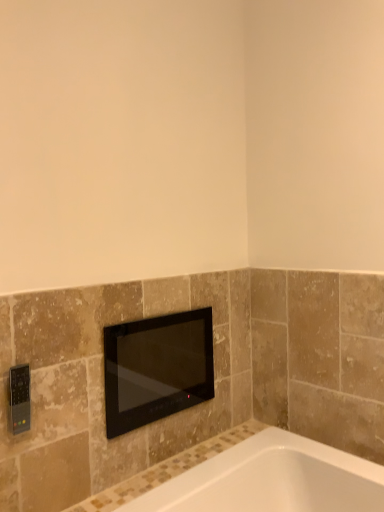
This screenshot has height=512, width=384. What do you see at coordinates (157, 368) in the screenshot?
I see `black glass television at center` at bounding box center [157, 368].

What is the approximate height of black glass television at center?

black glass television at center is 12.89 inches tall.

Locate an element on the screen. black glass television at center is located at coordinates (157, 368).

Identify the location of black plastic remote control at lower left. The image size is (384, 512). (20, 398).

This screenshot has width=384, height=512. What do you see at coordinates (20, 398) in the screenshot? I see `black plastic remote control at lower left` at bounding box center [20, 398].

I want to click on black glass television at center, so click(157, 368).

Is black plastic remote control at lower left at the left side of black glass television at center?

Yes.

Considering the relative positions of black plastic remote control at lower left and black glass television at center in the image provided, is black plastic remote control at lower left in front of black glass television at center?

Yes, the depth of black plastic remote control at lower left is less than that of black glass television at center.

Which is behind, point (24, 399) or point (132, 381)?

Positioned behind is point (132, 381).

From the image's perspective, is black plastic remote control at lower left above or below black glass television at center?

From the image's perspective, black plastic remote control at lower left appears above black glass television at center.

From a real-world perspective, is black plastic remote control at lower left positioned above or below black glass television at center?

From a real-world perspective, black plastic remote control at lower left is physically above black glass television at center.

Based on the photo, is black plastic remote control at lower left thinner than black glass television at center?

Correct, the width of black plastic remote control at lower left is less than that of black glass television at center.

Between black plastic remote control at lower left and black glass television at center, which one has more height?

black glass television at center.

Considering the relative sizes of black plastic remote control at lower left and black glass television at center in the image provided, is black plastic remote control at lower left bigger than black glass television at center?

Incorrect, black plastic remote control at lower left is not larger than black glass television at center.

Would you say black glass television at center is part of black plastic remote control at lower left's contents?

No, black plastic remote control at lower left does not contain black glass television at center.

Is black plastic remote control at lower left far away from black glass television at center?

No, black plastic remote control at lower left is in close proximity to black glass television at center.

Is black plastic remote control at lower left facing towards black glass television at center?

No, black plastic remote control at lower left is not oriented towards black glass television at center.

You are a GUI agent. You are given a task and a screenshot of the screen. Output one action in this format:
    pyautogui.click(x=<x>, y=<y>)
    Task: Click on the television behind the black plastic remote control at lower left
    Image resolution: width=384 pixels, height=512 pixels.
    Given the screenshot: What is the action you would take?
    pyautogui.click(x=157, y=368)

Which is more to the left, black glass television at center or black plastic remote control at lower left?

Positioned to the left is black plastic remote control at lower left.

Is black glass television at center closer to camera compared to black plastic remote control at lower left?

No, it is behind black plastic remote control at lower left.

Which point is more distant from viewer, (148, 417) or (21, 396)?

The point (148, 417) is behind.

From the image's perspective, is black glass television at center over black plastic remote control at lower left?

Actually, black glass television at center appears below black plastic remote control at lower left in the image.

From a real-world perspective, is black glass television at center under black plastic remote control at lower left?

Yes, from a real-world perspective, black glass television at center is beneath black plastic remote control at lower left.

Considering the sizes of objects black glass television at center and black plastic remote control at lower left in the image provided, who is thinner, black glass television at center or black plastic remote control at lower left?

black plastic remote control at lower left is thinner.

From the picture: Can you confirm if black glass television at center is taller than black plastic remote control at lower left?

Indeed, black glass television at center has a greater height compared to black plastic remote control at lower left.

Considering the sizes of objects black glass television at center and black plastic remote control at lower left in the image provided, who is smaller, black glass television at center or black plastic remote control at lower left?

black plastic remote control at lower left.

Can we say black glass television at center lies outside black plastic remote control at lower left?

Yes, black glass television at center is not within black plastic remote control at lower left.

Are black glass television at center and black plastic remote control at lower left located far from each other?

That's not correct — black glass television at center is a little close to black plastic remote control at lower left.

Does black glass television at center turn towards black plastic remote control at lower left?

No, black glass television at center does not turn towards black plastic remote control at lower left.

This screenshot has width=384, height=512. In the image, there is a black plastic remote control at lower left. Find the location of `television below it (from the image's perspective)`. television below it (from the image's perspective) is located at coordinates (157, 368).

In the image, there is a black plastic remote control at lower left. In order to click on television below it (from a real-world perspective) in this screenshot , I will do `click(157, 368)`.

Image resolution: width=384 pixels, height=512 pixels. I want to click on light switch on the left of black glass television at center, so click(x=20, y=398).